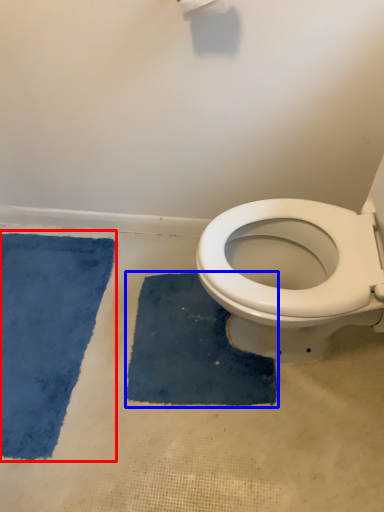
Question: Among these objects, which one is nearest to the camera, bath mat (highlighted by a red box) or bath mat (highlighted by a blue box)?

Choices:
 (A) bath mat
 (B) bath mat

Answer: (A)